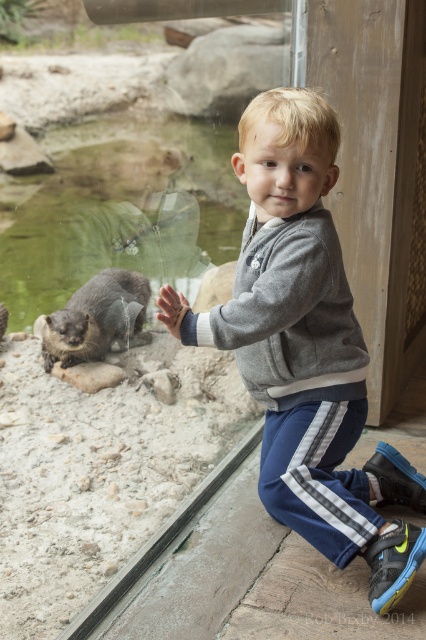
Does gray fleece jacket at center have a greater height compared to brown furry otter at lower left?

Yes, gray fleece jacket at center is taller than brown furry otter at lower left.

Which of these two, gray fleece jacket at center or brown furry otter at lower left, stands taller?

With more height is gray fleece jacket at center.

The image size is (426, 640). In order to click on gray fleece jacket at center in this screenshot , I will do `click(305, 348)`.

Does transparent glass door at center appear over gray heathered sweatshirt at center?

Correct, transparent glass door at center is located above gray heathered sweatshirt at center.

Can you confirm if transparent glass door at center is positioned below gray heathered sweatshirt at center?

No, transparent glass door at center is not below gray heathered sweatshirt at center.

Does point (132, 112) lie in front of point (348, 349)?

No, (132, 112) is behind (348, 349).

The width and height of the screenshot is (426, 640). I want to click on transparent glass door at center, so click(112, 365).

Who is taller, transparent glass door at center or brown furry otter at lower left?

transparent glass door at center

Can you confirm if transparent glass door at center is positioned to the right of brown furry otter at lower left?

Correct, you'll find transparent glass door at center to the right of brown furry otter at lower left.

Does point (290, 51) come farther from viewer compared to point (127, 282)?

Yes, point (290, 51) is farther from viewer.

The width and height of the screenshot is (426, 640). I want to click on transparent glass door at center, so click(112, 365).